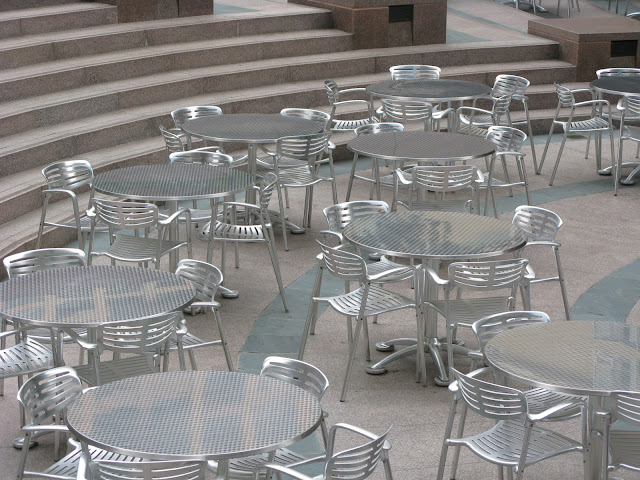
This screenshot has width=640, height=480. In order to click on table 4 chairs in this screenshot , I will do `click(22, 363)`, `click(128, 334)`, `click(208, 277)`, `click(40, 253)`.